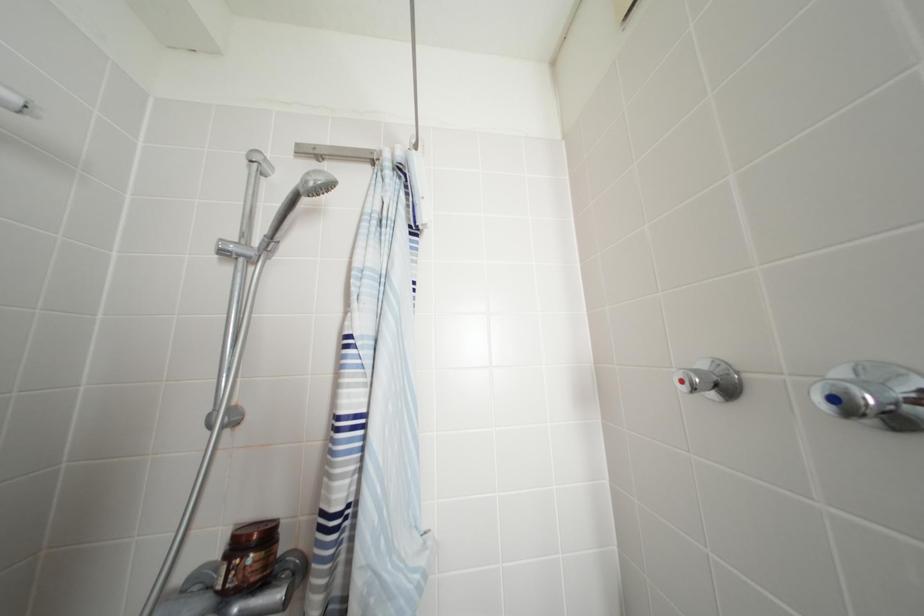
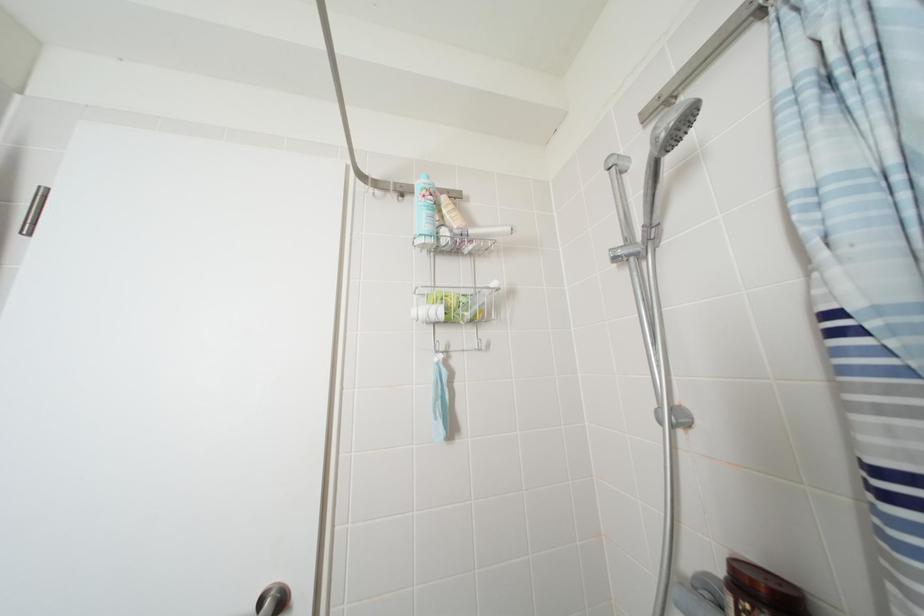
Question: The camera is either moving clockwise (left) or counter-clockwise (right) around the object. The first image is from the beginning of the video and the second image is from the end. Is the camera moving left or right when shooting the video?

Choices:
 (A) Left
 (B) Right

Answer: (B)